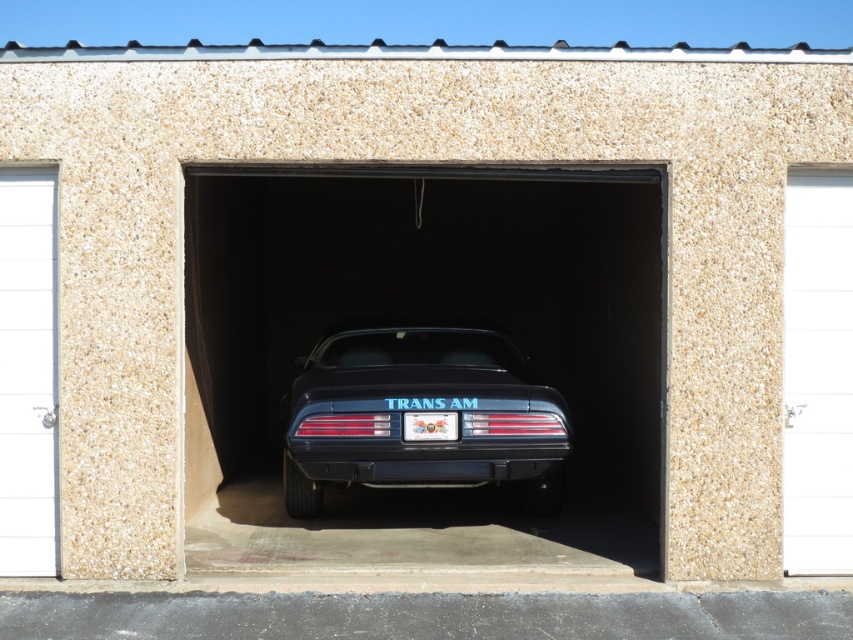
Who is shorter, white textured door at right or white smooth door at left?

With less height is white smooth door at left.

Who is lower down, white textured door at right or white smooth door at left?

white textured door at right is below.

Does point (793, 289) lie in front of point (45, 492)?

No, (793, 289) is behind (45, 492).

Find the location of a particular element. Image resolution: width=853 pixels, height=640 pixels. white textured door at right is located at coordinates (817, 372).

Between point (824, 483) and point (433, 420), which one is positioned behind?

Point (433, 420)

Can you confirm if white textured door at right is thinner than metallic silver license plate at center?

No, white textured door at right is not thinner than metallic silver license plate at center.

Where is `white textured door at right`? The height and width of the screenshot is (640, 853). white textured door at right is located at coordinates (817, 372).

You are a GUI agent. You are given a task and a screenshot of the screen. Output one action in this format:
    pyautogui.click(x=<x>, y=<y>)
    Task: Click on the white textured door at right
    The image size is (853, 640).
    Given the screenshot: What is the action you would take?
    pyautogui.click(x=817, y=372)

Who is taller, glossy black trans am at center or white textured door at right?

white textured door at right is taller.

Does glossy black trans am at center appear on the right side of white textured door at right?

No, glossy black trans am at center is not to the right of white textured door at right.

You are a GUI agent. You are given a task and a screenshot of the screen. Output one action in this format:
    pyautogui.click(x=<x>, y=<y>)
    Task: Click on the glossy black trans am at center
    The width and height of the screenshot is (853, 640).
    Given the screenshot: What is the action you would take?
    pyautogui.click(x=421, y=410)